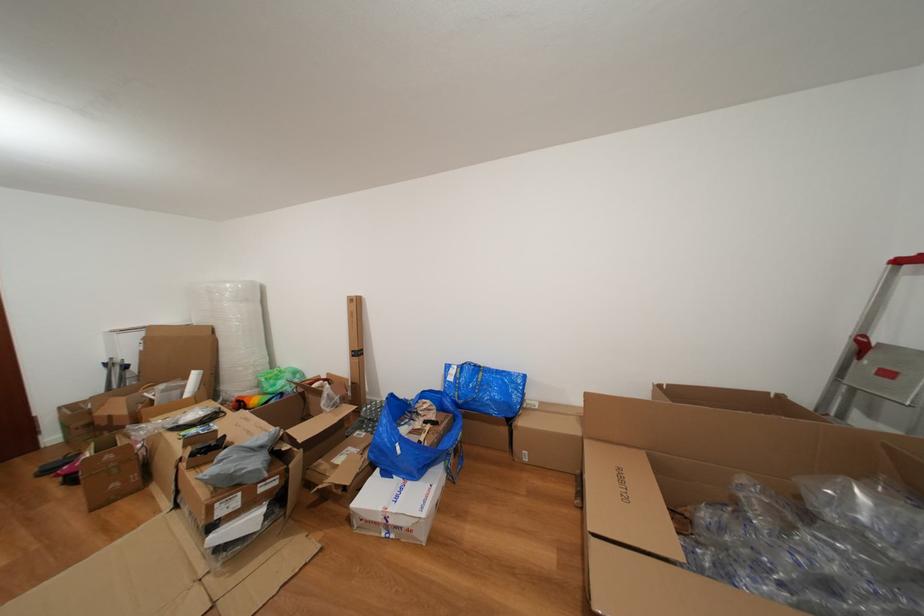
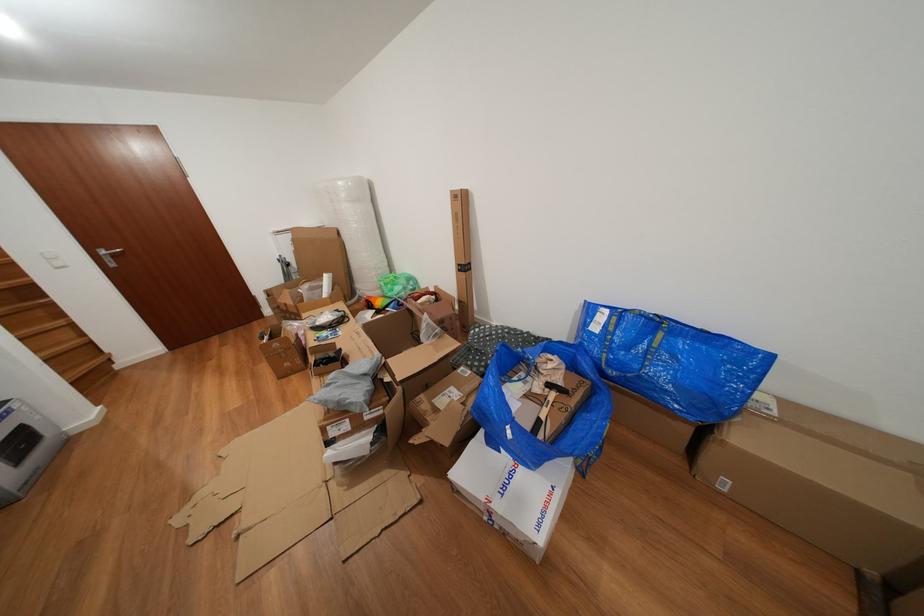
How did the camera likely rotate?

The rotation direction of the camera is left-down.